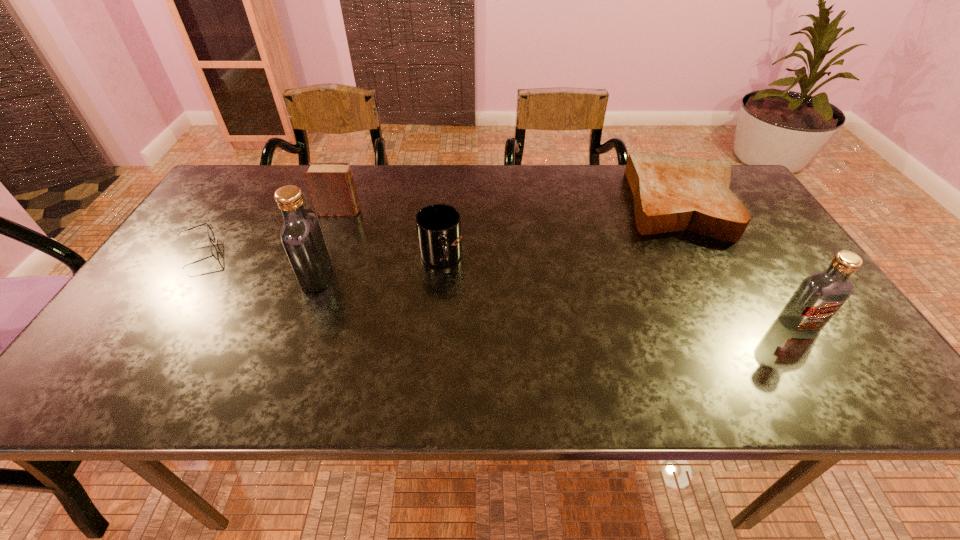
Please determine a free point for an extra vodka to ensure balance. Please provide its 2D coordinates. Your answer should be formatted as a tuple, i.e. [(x, y)], where the tuple contains the x and y coordinates of a point satisfying the conditions above.

[(546, 300)]